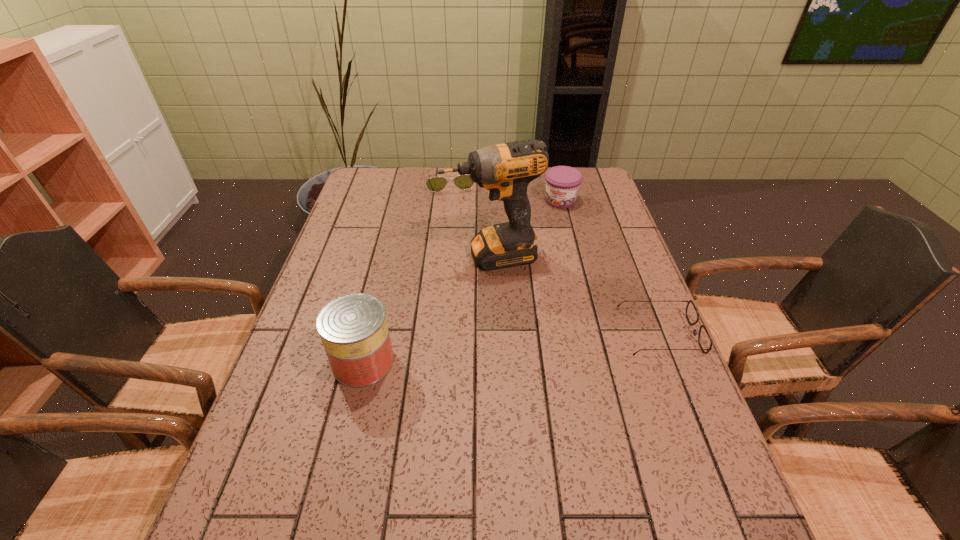
Locate an element on the screen. The height and width of the screenshot is (540, 960). vacant space located on the front label of the third shortest object is located at coordinates (528, 274).

Locate an element on the screen. This screenshot has width=960, height=540. vacant region located on the front label of the third shortest object is located at coordinates click(x=523, y=285).

The width and height of the screenshot is (960, 540). I want to click on vacant position located with the drill bit of the drill facing forward, so click(x=513, y=291).

Identify the location of vacant space located 0.100m with the drill bit of the drill facing forward. (515, 295).

This screenshot has width=960, height=540. I want to click on vacant space located with the drill bit of the drill facing forward, so click(x=526, y=319).

The width and height of the screenshot is (960, 540). I want to click on vacant area situated 0.120m on the front-facing side of the left sunglasses, so click(x=455, y=211).

The height and width of the screenshot is (540, 960). Identify the location of vacant area located 0.240m on the front-facing side of the left sunglasses. (459, 232).

Image resolution: width=960 pixels, height=540 pixels. In order to click on vacant position located 0.360m on the front-facing side of the left sunglasses in this screenshot , I will do pos(464,255).

Where is `jam located in the far edge section of the desktop`? jam located in the far edge section of the desktop is located at coordinates (562, 182).

The width and height of the screenshot is (960, 540). I want to click on sunglasses that is at the far edge, so click(464, 182).